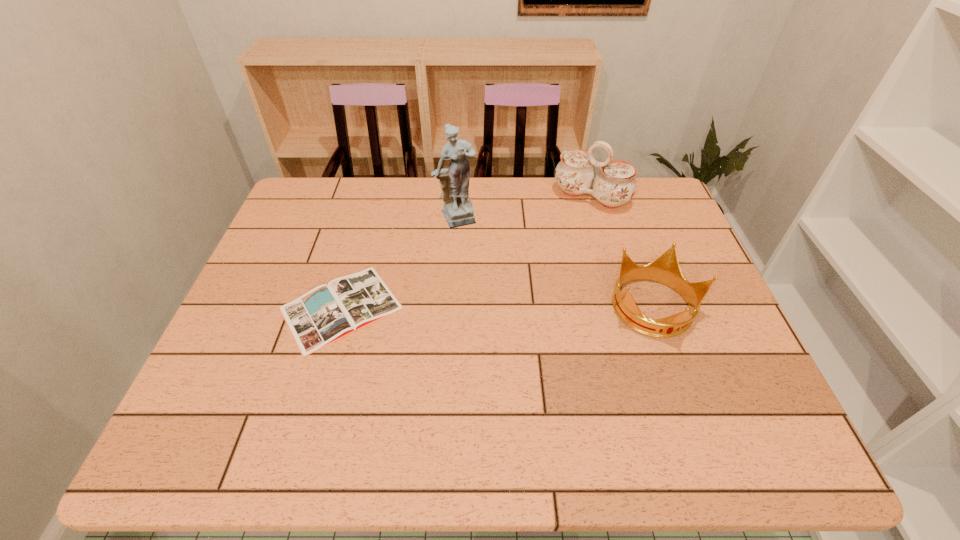
Locate an element on the screen. The image size is (960, 540). unoccupied area between the figurine and the second shortest object is located at coordinates (556, 264).

I want to click on free point between the chinaware and the figurine, so click(524, 208).

Locate an element on the screen. Image resolution: width=960 pixels, height=540 pixels. free area in between the book and the chinaware is located at coordinates pyautogui.click(x=466, y=252).

Locate an element on the screen. The image size is (960, 540). unoccupied position between the chinaware and the second shortest object is located at coordinates (623, 253).

Select which object appears as the second closest to the leftmost object. Please provide its 2D coordinates. Your answer should be formatted as a tuple, i.e. [(x, y)], where the tuple contains the x and y coordinates of a point satisfying the conditions above.

[(615, 184)]

Find the location of `object that can be found as the closest to the crown`. object that can be found as the closest to the crown is located at coordinates (615, 184).

The width and height of the screenshot is (960, 540). In order to click on free space that satisfies the following two spatial constraints: 1. on the front side of the crown; 2. on the right side of the third shortest object in this screenshot , I will do pos(624,308).

This screenshot has width=960, height=540. I want to click on free space that satisfies the following two spatial constraints: 1. on the front side of the crown; 2. on the left side of the second object from left to right, so click(x=452, y=308).